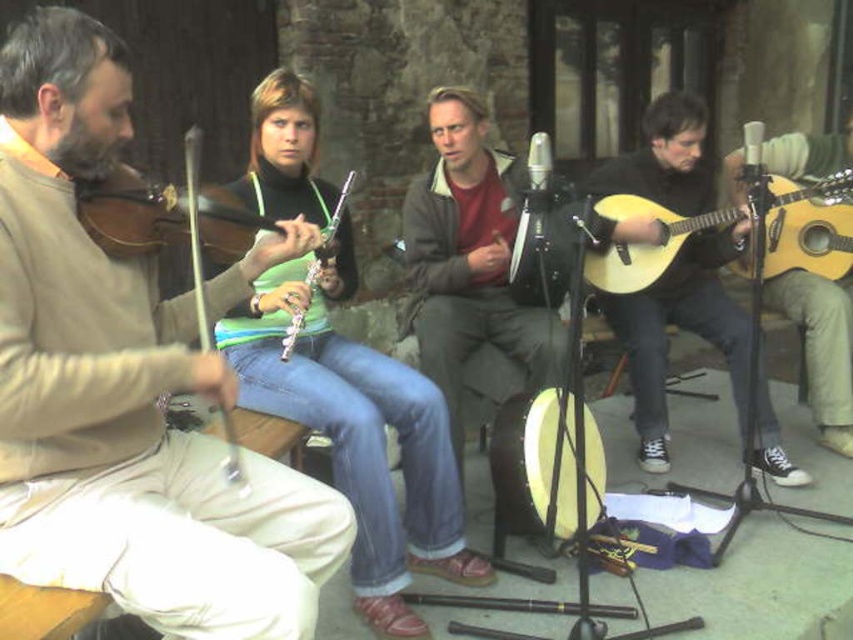
You are a musician who wants to carry both the light wood acoustic guitar at right and the matte brown violin at center in a backpack. Given their sizes, which one will require more space in your backpack?

The light wood acoustic guitar at right is larger in size than the matte brown violin at center, so it will require more space in the backpack.

You are a photographer aiming to capture a closeup of the wooden violin at left and the wooden violin at center. Which violin should you move your camera to the left to focus on?

The wooden violin at left is to the right of the wooden violin at center. To focus on the wooden violin at center, you should move your camera to the left.

You are standing at the center of the image. Which direction should you move to reach the wooden violin at left?

Since the wooden violin at left is located at point 0.345 on the x and y axis, you should move to the left and slightly downward to reach it from the center.